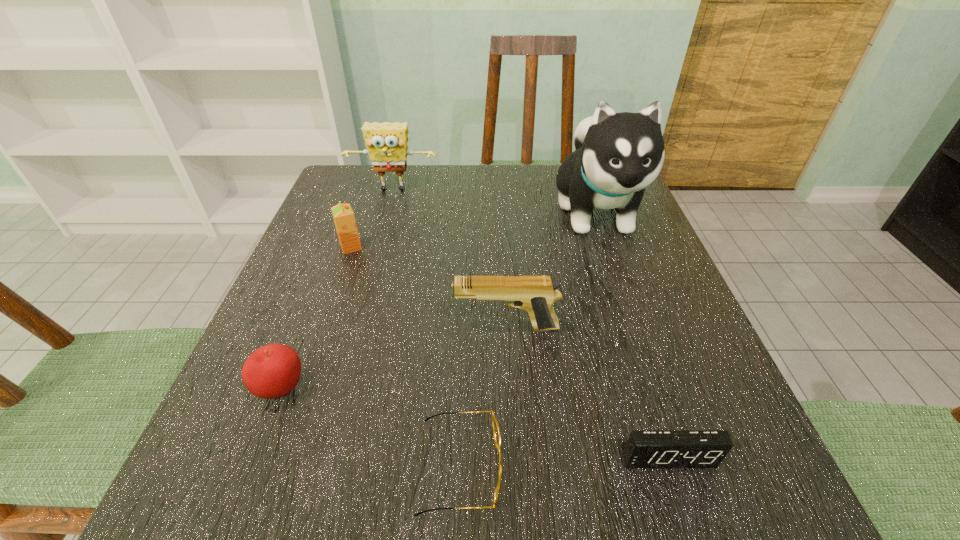
Image resolution: width=960 pixels, height=540 pixels. I want to click on vacant space located at the barrel of the fourth farthest object, so click(x=401, y=328).

Image resolution: width=960 pixels, height=540 pixels. What are the coordinates of `vacant region located 0.100m at the barrel of the fourth farthest object` in the screenshot? It's located at (396, 328).

You are a GUI agent. You are given a task and a screenshot of the screen. Output one action in this format:
    pyautogui.click(x=<x>, y=<y>)
    Task: Click on the vacant space located 0.190m at the barrel of the fourth farthest object
    
    Given the screenshot: What is the action you would take?
    pyautogui.click(x=342, y=328)

The width and height of the screenshot is (960, 540). Find the location of `vacant area situated on the right of the orange juice`. vacant area situated on the right of the orange juice is located at coordinates (552, 247).

This screenshot has height=540, width=960. I want to click on vacant region located 0.210m on the right of the fifth tallest object, so [448, 389].

Where is `free region located 0.050m on the front-facing side of the second shortest object`? The height and width of the screenshot is (540, 960). free region located 0.050m on the front-facing side of the second shortest object is located at coordinates (684, 510).

At what (x,y) coordinates should I click in order to perform the action: click on free location located 0.100m on the front-facing side of the shortest object. Please return your answer as a coordinate pair (x, y). Image resolution: width=960 pixels, height=540 pixels. Looking at the image, I should click on (578, 466).

In order to click on puppy that is at the far edge in this screenshot , I will do `click(617, 155)`.

Image resolution: width=960 pixels, height=540 pixels. Find the location of `sponge that is at the far edge`. sponge that is at the far edge is located at coordinates (386, 142).

In order to click on alarm clock located at the near edge in this screenshot , I will do `click(645, 448)`.